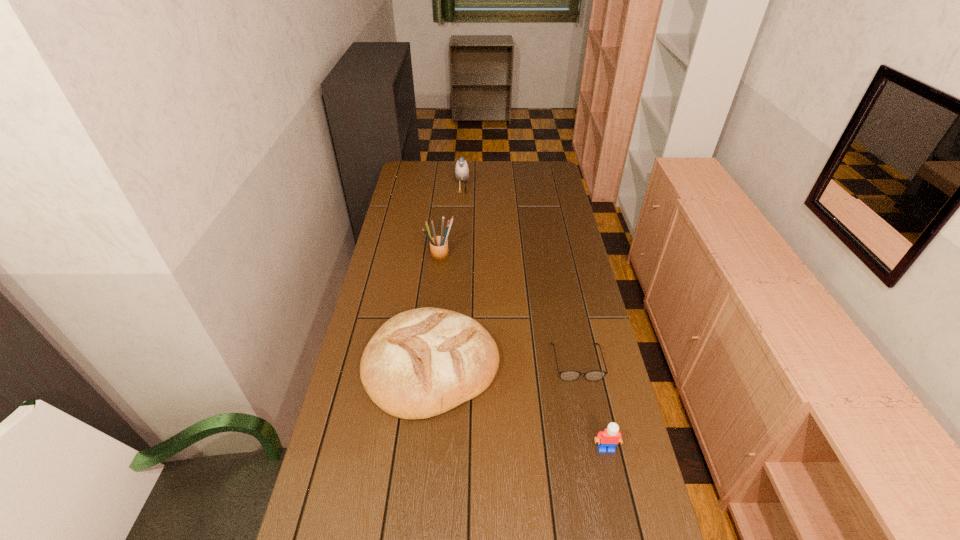
In order to click on free space between the bread and the farthest object in this screenshot , I will do `click(446, 278)`.

This screenshot has height=540, width=960. Identify the location of free space between the nearest object and the spectacles. (591, 405).

Where is `vacant region between the bird and the shortest object`? The image size is (960, 540). vacant region between the bird and the shortest object is located at coordinates (519, 276).

What are the coordinates of `vacant space that is in between the farthest object and the bread` in the screenshot? It's located at (446, 278).

Image resolution: width=960 pixels, height=540 pixels. What are the coordinates of `empty location between the bread and the Lego` in the screenshot? It's located at (518, 407).

Locate which object is the second closest to the bird. Please provide its 2D coordinates. Your answer should be formatted as a tuple, i.e. [(x, y)], where the tuple contains the x and y coordinates of a point satisfying the conditions above.

[(423, 362)]

I want to click on the closest object relative to the pencil box, so click(x=423, y=362).

This screenshot has width=960, height=540. Find the location of `free space that satisfies the following two spatial constraints: 1. at the tip of the bird's beak; 2. on the front side of the bread`. free space that satisfies the following two spatial constraints: 1. at the tip of the bird's beak; 2. on the front side of the bread is located at coordinates (453, 365).